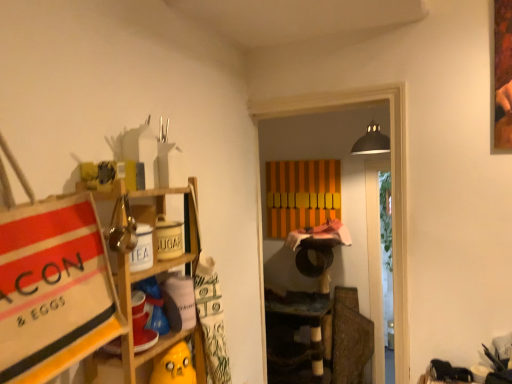
This screenshot has height=384, width=512. In order to click on orange striped cabinet at center in this screenshot , I will do `click(301, 194)`.

What do you see at coordinates (301, 194) in the screenshot? I see `orange striped cabinet at center` at bounding box center [301, 194].

Measure the distance between point (336, 188) and camera.

Point (336, 188) and camera are 3.18 meters apart from each other.

What do you see at coordinates (156, 274) in the screenshot? I see `wooden shelf at left` at bounding box center [156, 274].

Locate an element on the screen. wooden shelf at left is located at coordinates (156, 274).

What is the approximate width of wooden shelf at left?

The width of wooden shelf at left is 28.64 centimeters.

Identify the location of orange striped cabinet at center. This screenshot has width=512, height=384. (301, 194).

Considering the relative positions of wooden shelf at left and orange striped cabinet at center in the image provided, is wooden shelf at left to the left of orange striped cabinet at center from the viewer's perspective?

Indeed, wooden shelf at left is positioned on the left side of orange striped cabinet at center.

Is wooden shelf at left closer to camera compared to orange striped cabinet at center?

Yes, wooden shelf at left is in front of orange striped cabinet at center.

Is point (191, 192) more distant than point (331, 184)?

No, it is not.

From the image's perspective, between wooden shelf at left and orange striped cabinet at center, which one is located above?

orange striped cabinet at center.

From a real-world perspective, is wooden shelf at left under orange striped cabinet at center?

Yes.

Which of these two, wooden shelf at left or orange striped cabinet at center, is thinner?

With smaller width is orange striped cabinet at center.

From their relative heights in the image, would you say wooden shelf at left is taller or shorter than orange striped cabinet at center?

Considering their sizes, wooden shelf at left has more height than orange striped cabinet at center.

Looking at this image, does wooden shelf at left have a larger size compared to orange striped cabinet at center?

Indeed, wooden shelf at left has a larger size compared to orange striped cabinet at center.

Is wooden shelf at left spatially inside orange striped cabinet at center, or outside of it?

wooden shelf at left is not inside orange striped cabinet at center, it's outside.

Is wooden shelf at left not close to orange striped cabinet at center?

wooden shelf at left is far away from orange striped cabinet at center.

Could you tell me if wooden shelf at left is turned towards orange striped cabinet at center?

No.

The width and height of the screenshot is (512, 384). I want to click on cabinet located above the wooden shelf at left (from the image's perspective), so click(x=301, y=194).

Is orange striped cabinet at center to the right of wooden shelf at left from the viewer's perspective?

Indeed, orange striped cabinet at center is positioned on the right side of wooden shelf at left.

In the image, is orange striped cabinet at center positioned in front of or behind wooden shelf at left?

orange striped cabinet at center is behind wooden shelf at left.

Is point (310, 190) positioned in front of point (195, 213)?

No, (310, 190) is further to viewer.

From the image's perspective, is orange striped cabinet at center located beneath wooden shelf at left?

No, from the image's perspective, orange striped cabinet at center is not beneath wooden shelf at left.

From a real-world perspective, is orange striped cabinet at center located higher than wooden shelf at left?

Yes, from a real-world perspective, orange striped cabinet at center is above wooden shelf at left.

Considering the relative sizes of orange striped cabinet at center and wooden shelf at left in the image provided, is orange striped cabinet at center wider than wooden shelf at left?

In fact, orange striped cabinet at center might be narrower than wooden shelf at left.

Considering the sizes of objects orange striped cabinet at center and wooden shelf at left in the image provided, who is taller, orange striped cabinet at center or wooden shelf at left?

Standing taller between the two is wooden shelf at left.

In terms of size, does orange striped cabinet at center appear bigger or smaller than wooden shelf at left?

Clearly, orange striped cabinet at center is smaller in size than wooden shelf at left.

Can we say orange striped cabinet at center lies outside wooden shelf at left?

Absolutely, orange striped cabinet at center is external to wooden shelf at left.

Is there a large distance between orange striped cabinet at center and wooden shelf at left?

That's right, there is a large distance between orange striped cabinet at center and wooden shelf at left.

Is orange striped cabinet at center looking in the opposite direction of wooden shelf at left?

That's not correct — orange striped cabinet at center is not looking away from wooden shelf at left.

How many degrees apart are the facing directions of orange striped cabinet at center and wooden shelf at left?

There is a 88.7-degree angle between the facing directions of orange striped cabinet at center and wooden shelf at left.

How far apart are orange striped cabinet at center and wooden shelf at left?

The distance of orange striped cabinet at center from wooden shelf at left is 6.64 feet.

Image resolution: width=512 pixels, height=384 pixels. I want to click on cabinet on the right side of wooden shelf at left, so click(301, 194).

Locate an element on the screen. The image size is (512, 384). shelf below the orange striped cabinet at center (from the image's perspective) is located at coordinates (156, 274).

You are a GUI agent. You are given a task and a screenshot of the screen. Output one action in this format:
    pyautogui.click(x=<x>, y=<y>)
    Task: Click on the cabinet above the wooden shelf at left (from the image's perspective)
    This screenshot has height=384, width=512.
    Given the screenshot: What is the action you would take?
    pyautogui.click(x=301, y=194)